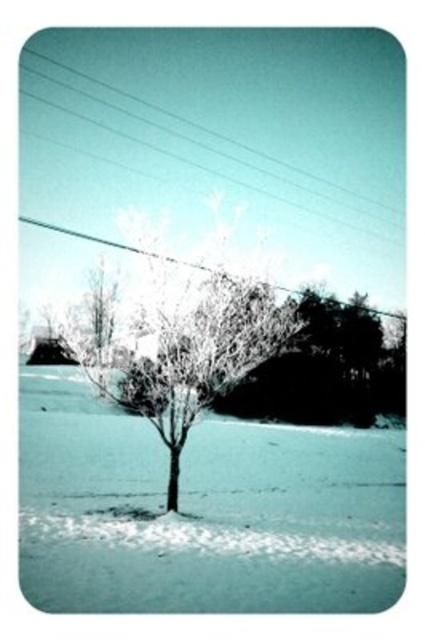
You are an artist sketching this winter scene. You want to draw the white frosty tree at center and the metallic wire at upper center accurately. Which object should you draw first to ensure proper layering?

You should draw the metallic wire at upper center first because the white frosty tree at center is in front of it, so the tree will cover part of the wire when layered correctly.

You are a bird flying over the winter landscape and want to land on the white frosty tree at center. Are you above or below the metallic wire at upper center when you are on the tree?

The white frosty tree at center is located below the metallic wire at upper center, so when you are on the tree, you are below the metallic wire at upper center.